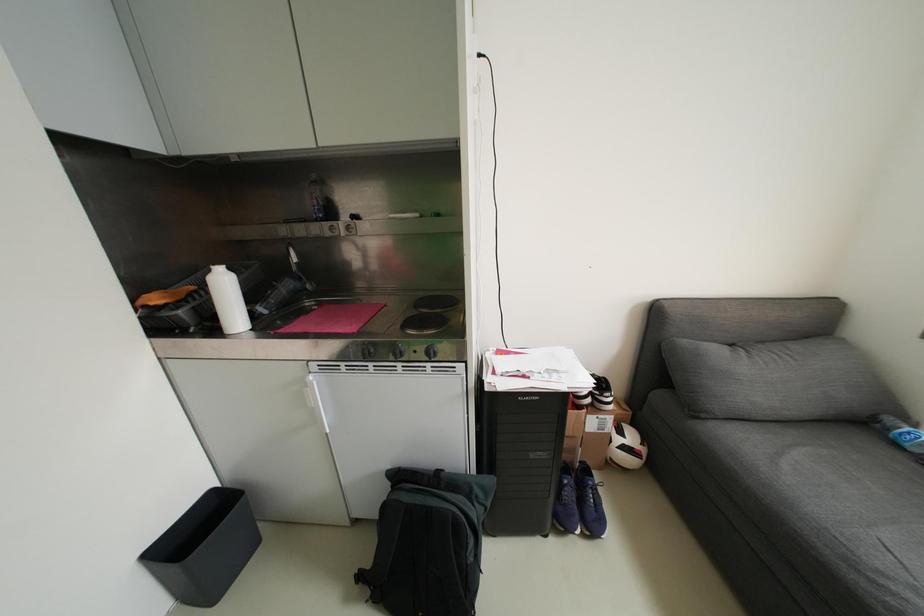
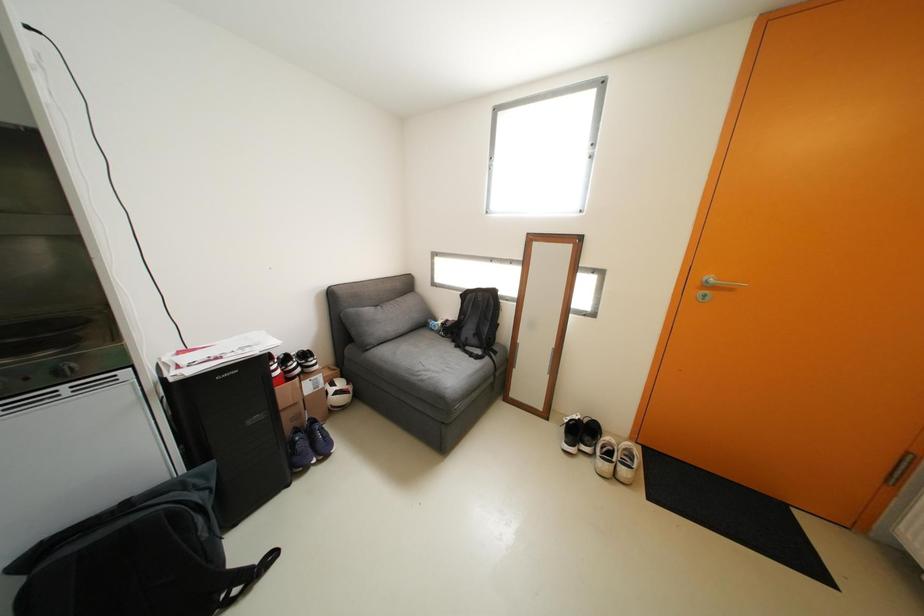
Question: How did the camera likely rotate?

Choices:
 (A) Left
 (B) Right
 (C) Up
 (D) Down

Answer: (B)